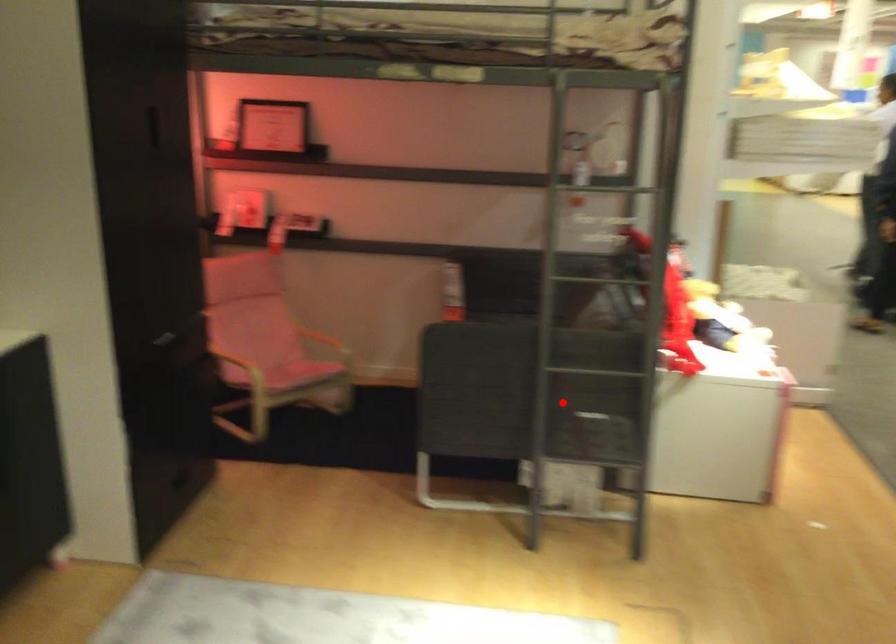
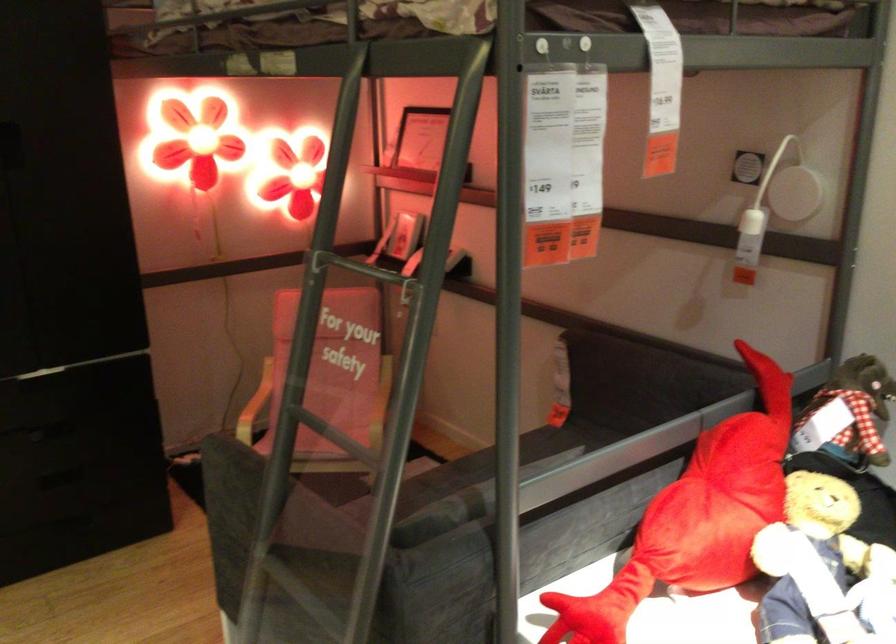
Question: I am providing you with two images of the same scene from different viewpoints. In image1, a red point is highlighted. Considering the same 3D point in image2, which of the following is correct?

Choices:
 (A) It is closer
 (B) It is farther

Answer: (A)